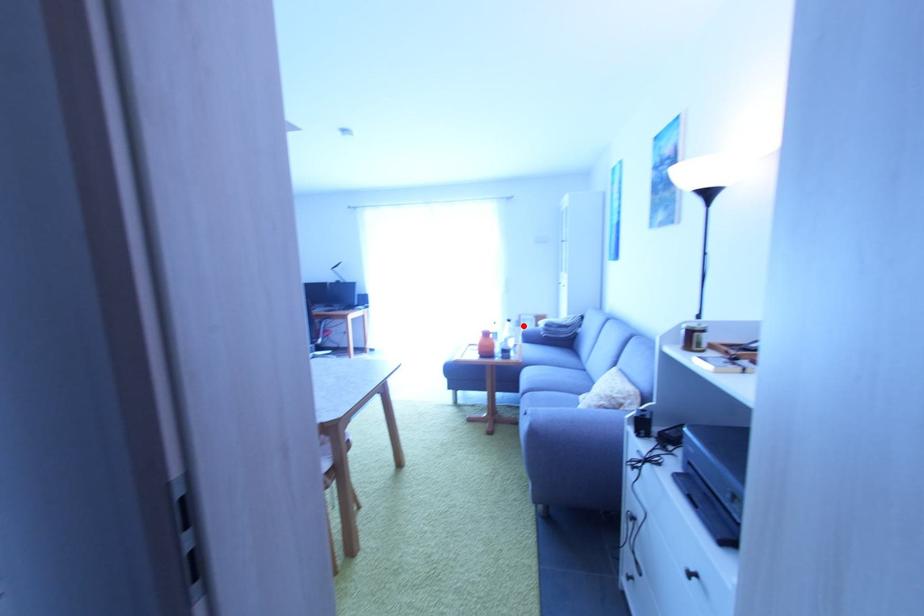
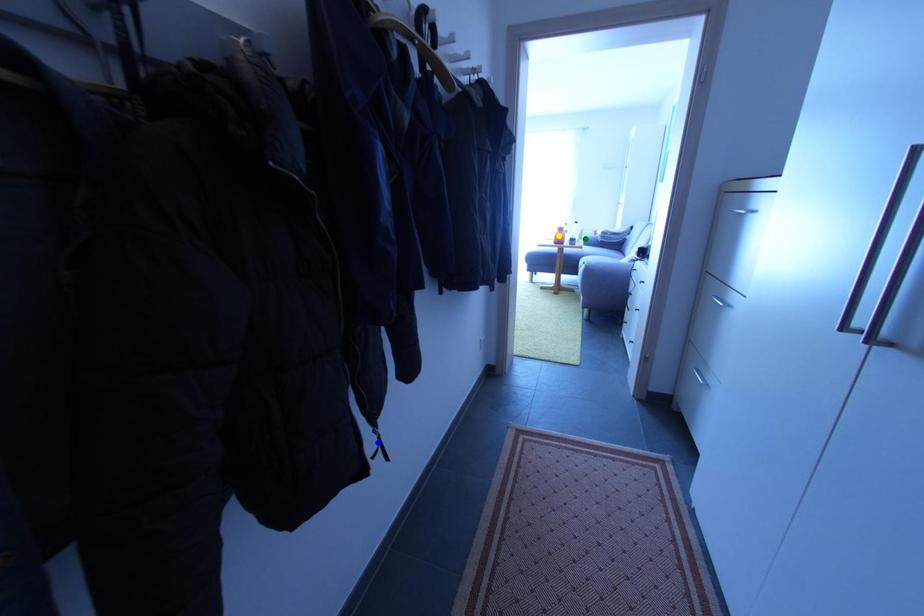
Question: I am providing you with two images of the same scene from different viewpoints. A red point is marked on the first image. You are given multiple points on the second image. Which mark in image 2 goes with the point in image 1?

Choices:
 (A) blue point
 (B) green point
 (C) yellow point

Answer: (B)